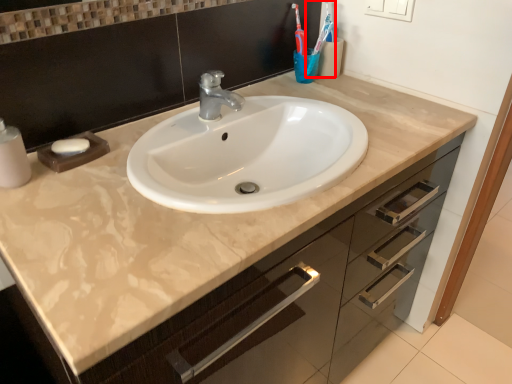
Question: In this image, where is toothbrush (annotated by the red box) located relative to soap?

Choices:
 (A) right
 (B) left

Answer: (A)